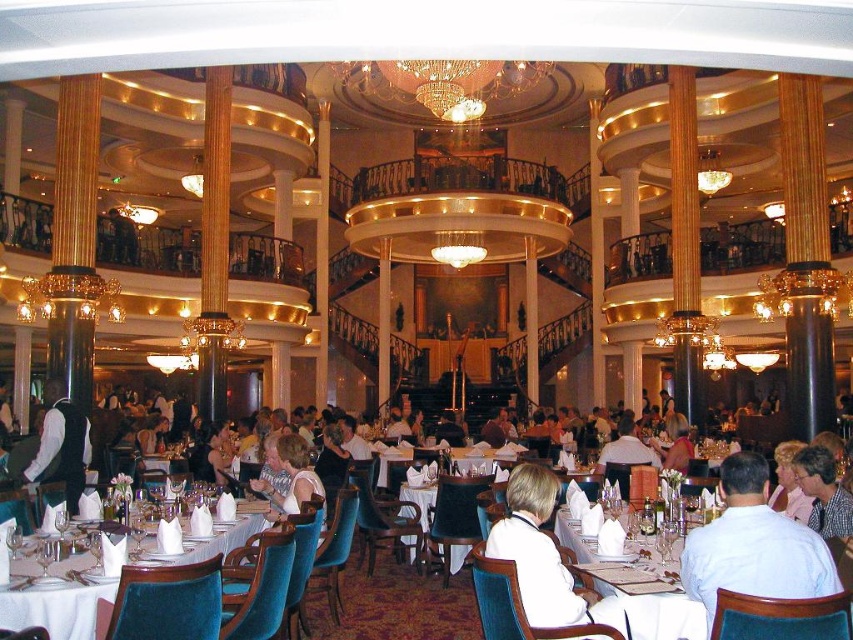
Who is positioned more to the right, white shirt at center or plaid shirt at center?

plaid shirt at center

Does white shirt at center have a greater height compared to plaid shirt at center?

Correct, white shirt at center is much taller as plaid shirt at center.

Is point (755, 516) closer to viewer compared to point (842, 516)?

Yes.

Find the location of `white shirt at center`. white shirt at center is located at coordinates (753, 545).

Who is shorter, white cloth at center or white paper napkin at center?

With less height is white cloth at center.

Does white cloth at center have a greater height compared to white paper napkin at center?

No, white cloth at center is not taller than white paper napkin at center.

Locate an element on the screen. The image size is (853, 640). white cloth at center is located at coordinates (x=55, y=609).

Is point (570, 593) more distant than point (289, 464)?

No, it is not.

You are a GUI agent. You are given a task and a screenshot of the screen. Output one action in this format:
    pyautogui.click(x=<x>, y=<y>)
    Task: Click on the white matte shirt at center
    The image size is (853, 640).
    Given the screenshot: What is the action you would take?
    pyautogui.click(x=537, y=552)